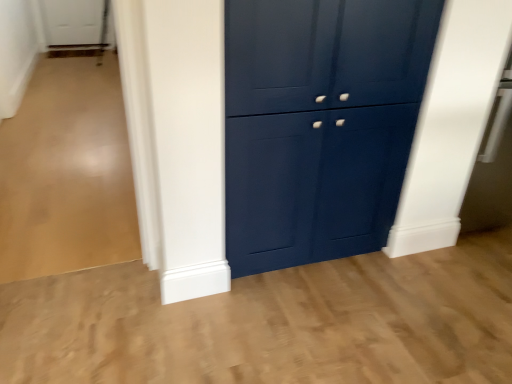
Where is `free point to the right of glossy blue cupboard at center`? This screenshot has height=384, width=512. free point to the right of glossy blue cupboard at center is located at coordinates (409, 284).